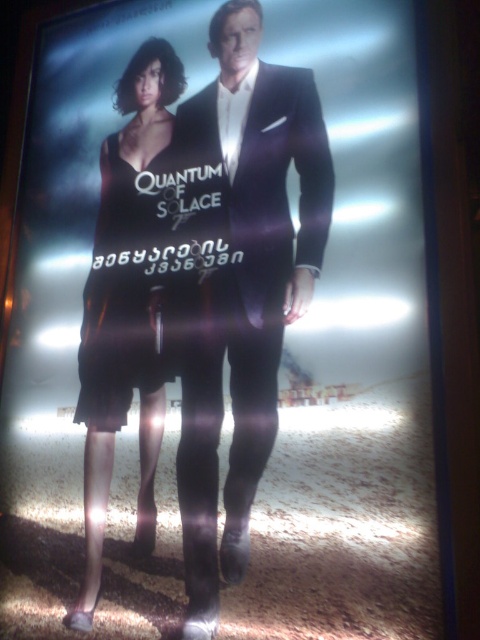
What is the color of the dress worn by the character positioned at the coordinates point (123, 310) in the image?

The point (123, 310) corresponds to the satin black dress at left, so the dress is black.

You are a costume designer who needs to determine which clothing item takes up more visual space on the movie poster. Based on the image, which one is larger between the shiny black suit at center and the satin black dress at left?

The shiny black suit at center is bigger than the satin black dress at left, so the shiny black suit at center takes up more visual space on the movie poster.

You are standing at the camera position looking at the movie poster for Quantum of Solace. There is a point marked at coordinates (254, 144) on the poster. If you want to touch this point with a 6.5 foot long pole, will the pole reach it?

The point at (254, 144) is 6.51 feet away from the camera position. Since the pole is only 6.5 feet long, it will be just short of reaching the point.